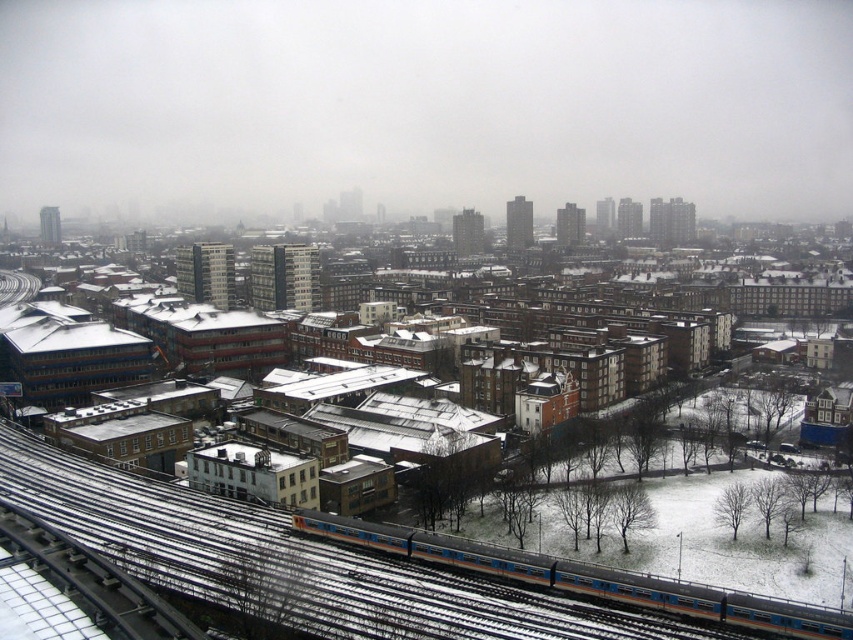
You are a city planner assessing the railway infrastructure. The blue metallic train at lower center needs to be placed on the metallic silver train track at lower left. Is there a possibility that the train is too wide to fit on the track?

The blue metallic train at lower center might be wider than the metallic silver train track at lower left, so there is a possibility that the train is too wide to fit on the track.

You are a city planner analyzing the railway infrastructure in this winter scene. Given the blue metallic train at lower center and the metallic silver train track at lower left, can you determine if the train is positioned on the track or not?

The distance between the blue metallic train at lower center and the metallic silver train track at lower left is 41.78 meters, which suggests the train is not positioned on the track but rather at a significant distance away from it.

You are a city planner analyzing the urban layout. Given the coordinates of the blue metallic train at lower center, what is its exact location in the image?

The blue metallic train at lower center is located at coordinates point (585, 577).